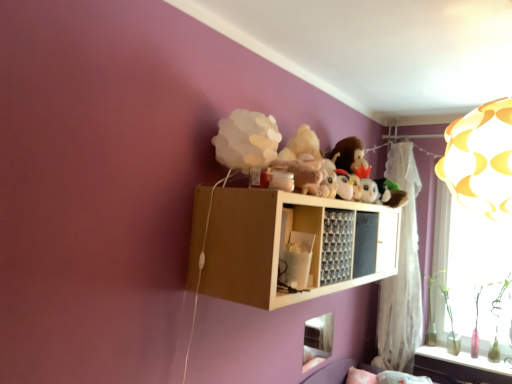
Question: From the image's perspective, is white paper lampshade at upper center, acting as the 1th toy starting from the left, positioned above or below wooden shelf at upper center?

Choices:
 (A) below
 (B) above

Answer: (B)

Question: Is white paper lampshade at upper center, the 2th toy viewed from the right, in front of or behind wooden shelf at upper center in the image?

Choices:
 (A) front
 (B) behind

Answer: (B)

Question: Which object is the closest to the clear glass bottles at lower right?

Choices:
 (A) white paper lampshade at upper center, the first toy viewed from the front
 (B) transparent plastic at right
 (C) wooden shelf at upper center
 (D) white sheer curtain at upper right
 (E) white plush penguin at center, arranged as the second toy when viewed from the left

Answer: (D)

Question: Which object is positioned closest to the transparent plastic at right?

Choices:
 (A) white sheer curtain at upper right
 (B) white plush penguin at center, placed as the first toy when sorted from back to front
 (C) white paper lampshade at upper center, the 2th toy viewed from the right
 (D) wooden shelf at upper center
 (E) clear glass bottles at lower right

Answer: (A)